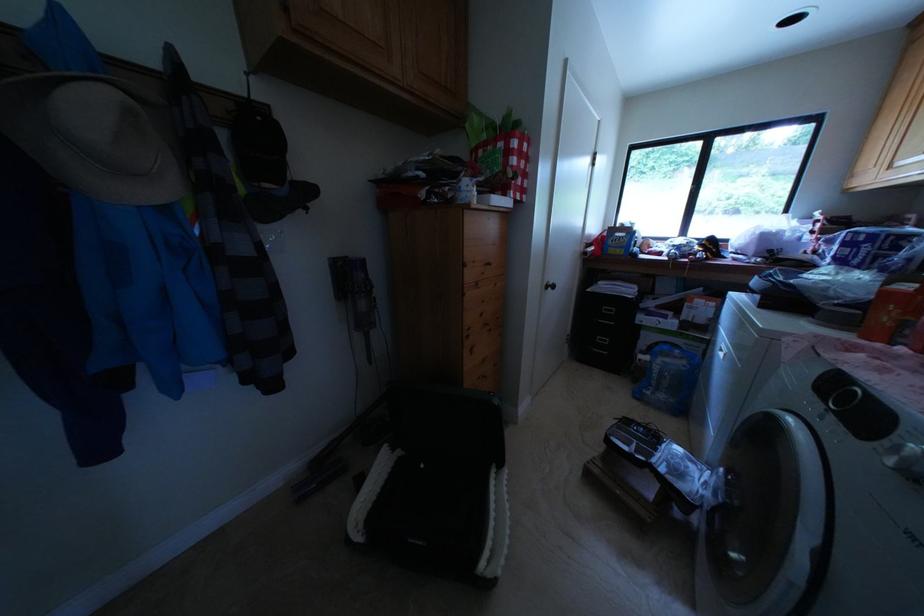
The image size is (924, 616). What do you see at coordinates (904, 458) in the screenshot? I see `a washing machine dial` at bounding box center [904, 458].